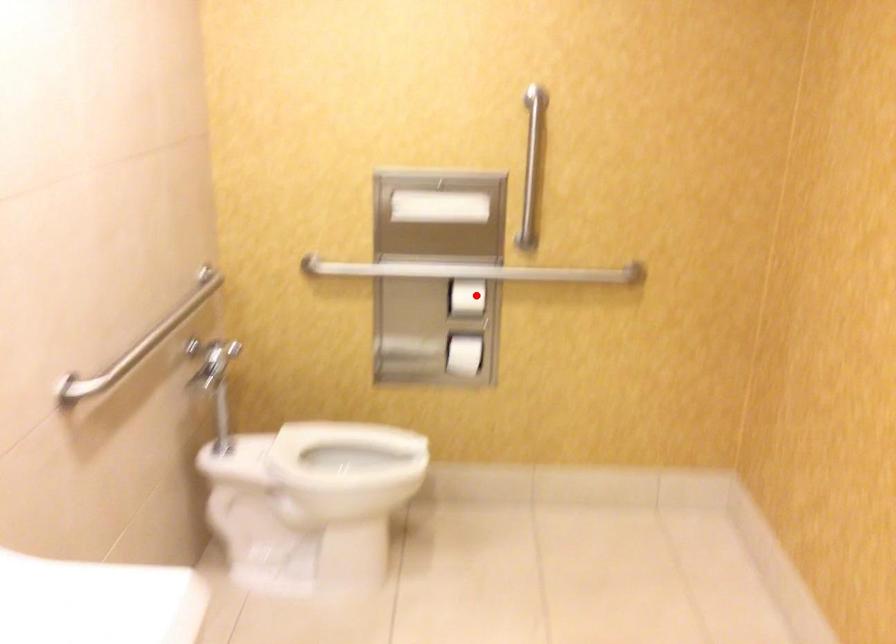
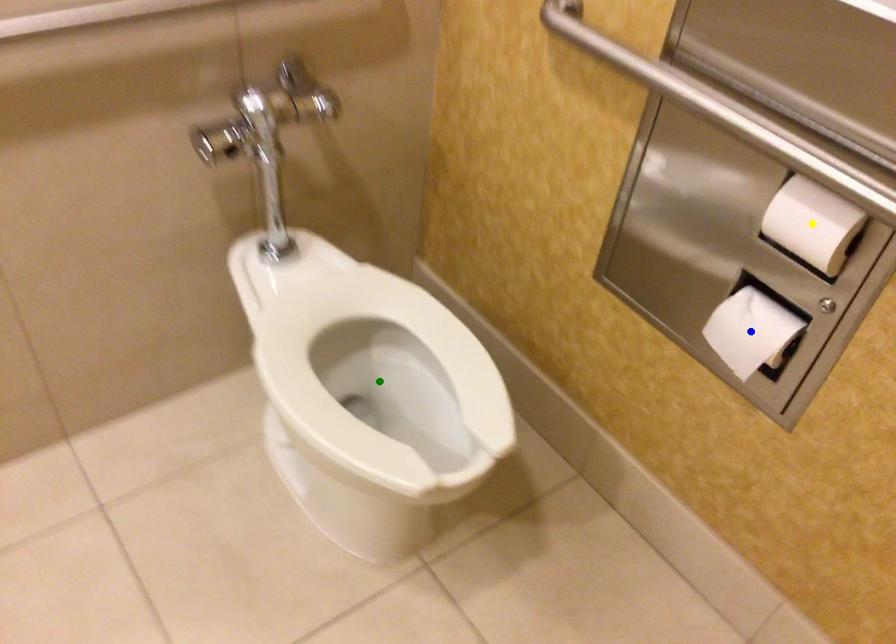
Question: I am providing you with two images of the same scene from different viewpoints. A red point is marked on the first image. You are given multiple points on the second image. Which mark in image 2 goes with the point in image 1?

Choices:
 (A) yellow point
 (B) blue point
 (C) green point

Answer: (A)